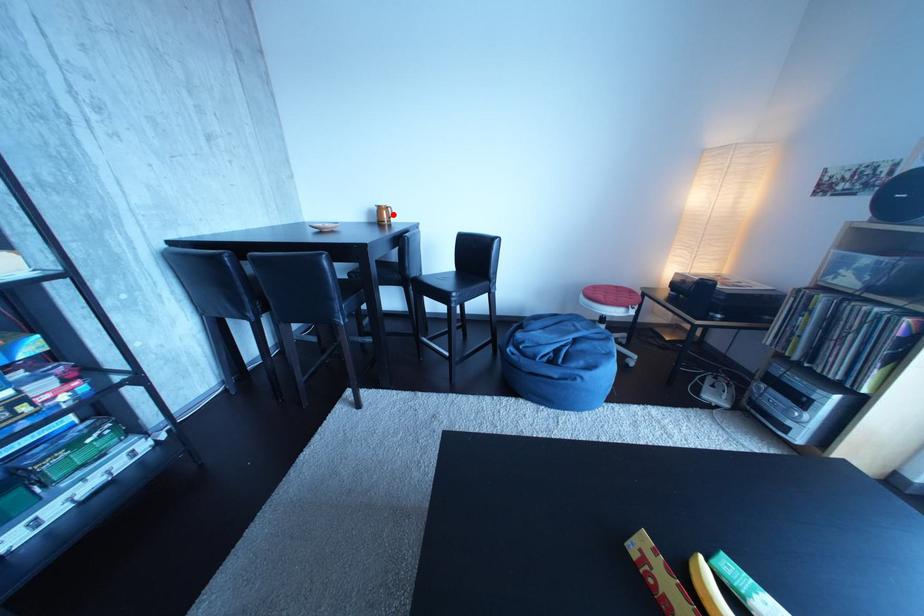
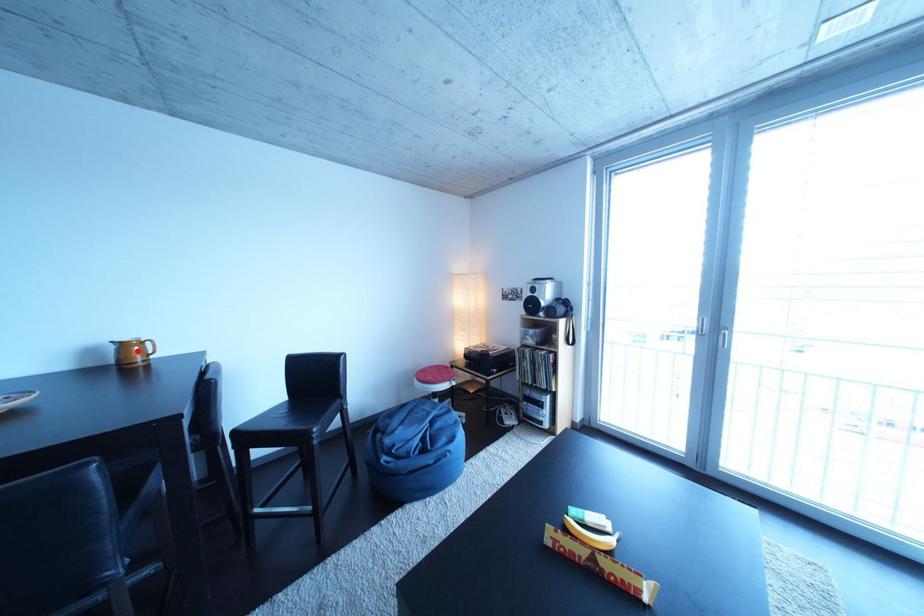
I am providing you with two images of the same scene from different viewpoints. A red point is marked on the first image and another point is marked on the second image. Is the red point in image1 aligned with the point shown in image2?

Yes